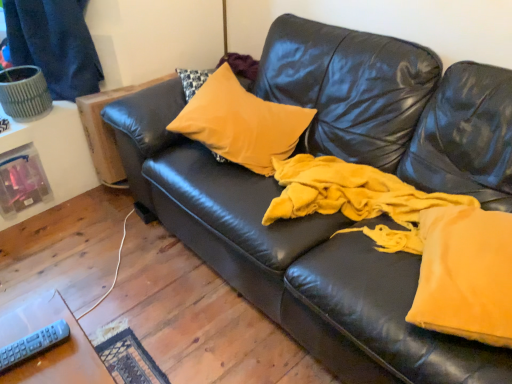
What is the approximate height of gray plastic remote at lower left?

gray plastic remote at lower left is 1.32 inches in height.

Describe the element at coordinates (33, 344) in the screenshot. I see `gray plastic remote at lower left` at that location.

The width and height of the screenshot is (512, 384). Describe the element at coordinates (54, 44) in the screenshot. I see `dark blue fabric at upper left` at that location.

Measure the distance between satin yellow pillow at center and camera.

satin yellow pillow at center and camera are 1.53 meters apart from each other.

This screenshot has width=512, height=384. What are the coordinates of `satin yellow pillow at center` in the screenshot? It's located at (241, 123).

The height and width of the screenshot is (384, 512). In order to click on velvet yellow blanket at center, which appears as the 2th fabric when viewed from the front in this screenshot , I will do `click(416, 240)`.

You are a GUI agent. You are given a task and a screenshot of the screen. Output one action in this format:
    pyautogui.click(x=<x>, y=<y>)
    Task: Click on the velvet yellow pillow at right, the first fabric in the front-to-back sequence
    This screenshot has height=384, width=512.
    Given the screenshot: What is the action you would take?
    pyautogui.click(x=465, y=274)

This screenshot has width=512, height=384. I want to click on gray plastic remote at lower left, so click(33, 344).

Which is more to the left, gray plastic remote at lower left or satin yellow pillow at center?

gray plastic remote at lower left is more to the left.

Is gray plastic remote at lower left not within satin yellow pillow at center?

That's correct, gray plastic remote at lower left is outside of satin yellow pillow at center.

From the picture: Can you confirm if gray plastic remote at lower left is thinner than satin yellow pillow at center?

Indeed, gray plastic remote at lower left has a lesser width compared to satin yellow pillow at center.

Is gray plastic remote at lower left not near satin yellow pillow at center?

Absolutely, gray plastic remote at lower left is distant from satin yellow pillow at center.

Is velvet yellow blanket at center, placed as the first fabric when sorted from back to front, facing away from gray plastic remote at lower left?

No, gray plastic remote at lower left is not at the back of velvet yellow blanket at center, placed as the first fabric when sorted from back to front.

Is the surface of velvet yellow blanket at center, which appears as the 2th fabric when viewed from the front, in direct contact with gray plastic remote at lower left?

They are not placed beside each other.

From the image's perspective, which is above, velvet yellow blanket at center, which appears as the 2th fabric when viewed from the front, or gray plastic remote at lower left?

velvet yellow blanket at center, which appears as the 2th fabric when viewed from the front.

From a real-world perspective, between velvet yellow blanket at center, which appears as the 2th fabric when viewed from the front, and gray plastic remote at lower left, who is vertically lower?

In real-world perspective, velvet yellow blanket at center, which appears as the 2th fabric when viewed from the front, is lower.

Is velvet yellow blanket at center, placed as the first fabric when sorted from back to front, a part of satin yellow pillow at center?

No, velvet yellow blanket at center, placed as the first fabric when sorted from back to front, is not inside satin yellow pillow at center.

Does satin yellow pillow at center lie behind velvet yellow blanket at center, placed as the first fabric when sorted from back to front?

Yes.

The height and width of the screenshot is (384, 512). Identify the location of pillow above the velvet yellow blanket at center, placed as the first fabric when sorted from back to front (from a real-world perspective). coord(241,123).

From a real-world perspective, is satin yellow pillow at center below velvet yellow blanket at center, which appears as the 2th fabric when viewed from the front?

Incorrect, from a real-world perspective, satin yellow pillow at center is higher than velvet yellow blanket at center, which appears as the 2th fabric when viewed from the front.

Considering the relative sizes of satin yellow pillow at center and velvet yellow pillow at right, the first fabric in the front-to-back sequence, in the image provided, is satin yellow pillow at center bigger than velvet yellow pillow at right, the first fabric in the front-to-back sequence,?

Indeed, satin yellow pillow at center has a larger size compared to velvet yellow pillow at right, the first fabric in the front-to-back sequence.

Looking at this image, from a real-world perspective, which object stands above the other?

From a 3D spatial view, satin yellow pillow at center is above.

From the picture: Is satin yellow pillow at center aimed at velvet yellow pillow at right, placed as the second fabric when sorted from back to front?

No, satin yellow pillow at center is not facing towards velvet yellow pillow at right, placed as the second fabric when sorted from back to front.

From the image's perspective, is satin yellow pillow at center positioned above or below velvet yellow pillow at right, placed as the second fabric when sorted from back to front?

From the image's perspective, satin yellow pillow at center appears above velvet yellow pillow at right, placed as the second fabric when sorted from back to front.

Looking at this image, considering the relative positions of dark blue fabric at upper left and velvet yellow pillow at right, the first fabric in the front-to-back sequence, in the image provided, is dark blue fabric at upper left to the left or to the right of velvet yellow pillow at right, the first fabric in the front-to-back sequence,?

dark blue fabric at upper left is positioned on velvet yellow pillow at right, the first fabric in the front-to-back sequence,'s left side.

From the image's perspective, who appears lower, dark blue fabric at upper left or velvet yellow pillow at right, the first fabric in the front-to-back sequence?

From the image's view, velvet yellow pillow at right, the first fabric in the front-to-back sequence, is below.

Would you say dark blue fabric at upper left is outside velvet yellow pillow at right, the first fabric in the front-to-back sequence?

dark blue fabric at upper left is positioned outside velvet yellow pillow at right, the first fabric in the front-to-back sequence.

At what (x,y) coordinates should I click in order to perform the action: click on the 1st fabric in front when counting from the satin yellow pillow at center. Please return your answer as a coordinate pair (x, y). This screenshot has width=512, height=384. Looking at the image, I should click on 416,240.

Is velvet yellow blanket at center, which appears as the 2th fabric when viewed from the front, aimed at satin yellow pillow at center?

No.

Is velvet yellow blanket at center, which appears as the 2th fabric when viewed from the front, taller than satin yellow pillow at center?

In fact, velvet yellow blanket at center, which appears as the 2th fabric when viewed from the front, may be shorter than satin yellow pillow at center.

Is velvet yellow blanket at center, which appears as the 2th fabric when viewed from the front, inside or outside of satin yellow pillow at center?

velvet yellow blanket at center, which appears as the 2th fabric when viewed from the front, exists outside the volume of satin yellow pillow at center.

Is gray plastic remote at lower left closer to camera compared to velvet yellow pillow at right, the first fabric in the front-to-back sequence?

Yes, gray plastic remote at lower left is in front of velvet yellow pillow at right, the first fabric in the front-to-back sequence.

Is gray plastic remote at lower left oriented towards velvet yellow pillow at right, placed as the second fabric when sorted from back to front?

No, gray plastic remote at lower left is not facing towards velvet yellow pillow at right, placed as the second fabric when sorted from back to front.

Is point (21, 353) positioned after point (508, 316)?

No, it is in front of (508, 316).

In terms of size, does gray plastic remote at lower left appear bigger or smaller than velvet yellow pillow at right, the first fabric in the front-to-back sequence?

gray plastic remote at lower left is smaller than velvet yellow pillow at right, the first fabric in the front-to-back sequence.

I want to click on remote above the satin yellow pillow at center (from a real-world perspective), so click(33, 344).

You are a GUI agent. You are given a task and a screenshot of the screen. Output one action in this format:
    pyautogui.click(x=<x>, y=<y>)
    Task: Click on the remote that appears below the velvet yellow blanket at center, which appears as the 2th fabric when viewed from the front (from the image's perspective)
    
    Given the screenshot: What is the action you would take?
    pyautogui.click(x=33, y=344)

Based on their spatial positions, is velvet yellow blanket at center, placed as the first fabric when sorted from back to front, or velvet yellow pillow at right, placed as the second fabric when sorted from back to front, further from dark blue fabric at upper left?

The object further to dark blue fabric at upper left is velvet yellow pillow at right, placed as the second fabric when sorted from back to front.

Considering their positions, is gray plastic remote at lower left positioned closer to dark blue fabric at upper left than velvet yellow blanket at center, placed as the first fabric when sorted from back to front?

velvet yellow blanket at center, placed as the first fabric when sorted from back to front, is positioned closer to the anchor dark blue fabric at upper left.

Looking at the image, which one is located closer to velvet yellow blanket at center, which appears as the 2th fabric when viewed from the front, velvet yellow pillow at right, placed as the second fabric when sorted from back to front, or dark blue fabric at upper left?

Among the two, velvet yellow pillow at right, placed as the second fabric when sorted from back to front, is located nearer to velvet yellow blanket at center, which appears as the 2th fabric when viewed from the front.

When comparing their distances from dark blue fabric at upper left, does satin yellow pillow at center or velvet yellow pillow at right, placed as the second fabric when sorted from back to front, seem further?

velvet yellow pillow at right, placed as the second fabric when sorted from back to front, is positioned further to the anchor dark blue fabric at upper left.

Estimate the real-world distances between objects in this image. Which object is closer to satin yellow pillow at center, dark blue fabric at upper left or gray plastic remote at lower left?

Based on the image, dark blue fabric at upper left appears to be nearer to satin yellow pillow at center.

From the image, which object appears to be nearer to satin yellow pillow at center, velvet yellow pillow at right, the first fabric in the front-to-back sequence, or velvet yellow blanket at center, placed as the first fabric when sorted from back to front?

velvet yellow blanket at center, placed as the first fabric when sorted from back to front, lies closer to satin yellow pillow at center than the other object.

Looking at the image, which one is located further to gray plastic remote at lower left, satin yellow pillow at center or velvet yellow blanket at center, placed as the first fabric when sorted from back to front?

satin yellow pillow at center is further to gray plastic remote at lower left.

Estimate the real-world distances between objects in this image. Which object is closer to gray plastic remote at lower left, velvet yellow pillow at right, placed as the second fabric when sorted from back to front, or satin yellow pillow at center?

The object closer to gray plastic remote at lower left is velvet yellow pillow at right, placed as the second fabric when sorted from back to front.

At what (x,y) coordinates should I click in order to perform the action: click on pillow situated between gray plastic remote at lower left and velvet yellow pillow at right, the first fabric in the front-to-back sequence, from left to right. Please return your answer as a coordinate pair (x, y). Looking at the image, I should click on (241, 123).

At what (x,y) coordinates should I click in order to perform the action: click on fabric between gray plastic remote at lower left and velvet yellow pillow at right, the first fabric in the front-to-back sequence. Please return your answer as a coordinate pair (x, y). The image size is (512, 384). Looking at the image, I should click on (416, 240).

Find the location of a particular element. The width and height of the screenshot is (512, 384). pillow situated between gray plastic remote at lower left and velvet yellow blanket at center, which appears as the 2th fabric when viewed from the front, from left to right is located at coordinates (241, 123).

Identify the location of pillow between dark blue fabric at upper left and velvet yellow blanket at center, placed as the first fabric when sorted from back to front. The height and width of the screenshot is (384, 512). (241, 123).